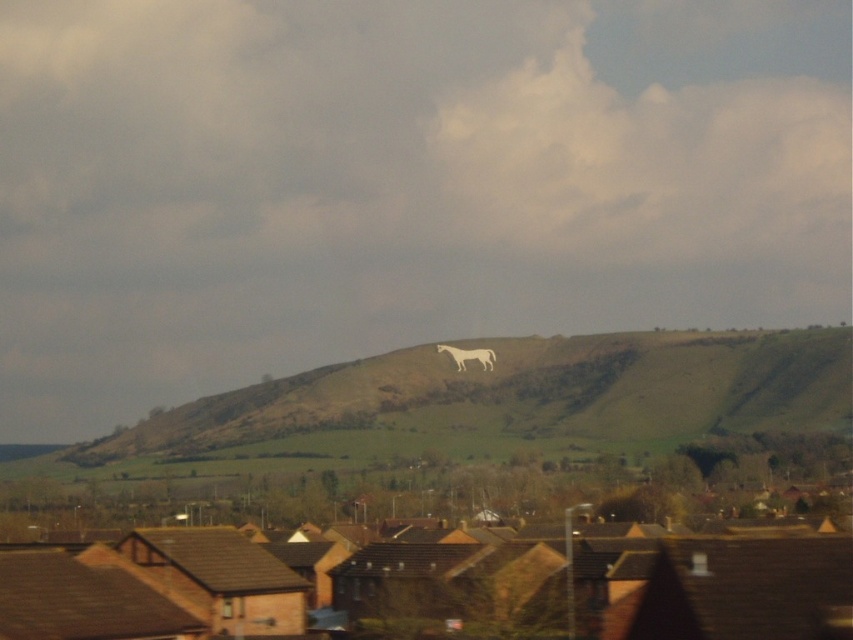
You are standing in the suburban neighborhood and looking at the cloudy sky at upper center and the white stone horse at center. Which object is located to the left of the other?

The cloudy sky at upper center is positioned on the left side of white stone horse at center.

You are a pilot preparing to land a small aircraft. You notice the cloudy sky at upper center and the white stone horse at center in your view. Which object is closer to your aircraft?

The cloudy sky at upper center is closer to the aircraft because the white stone horse at center is behind it.